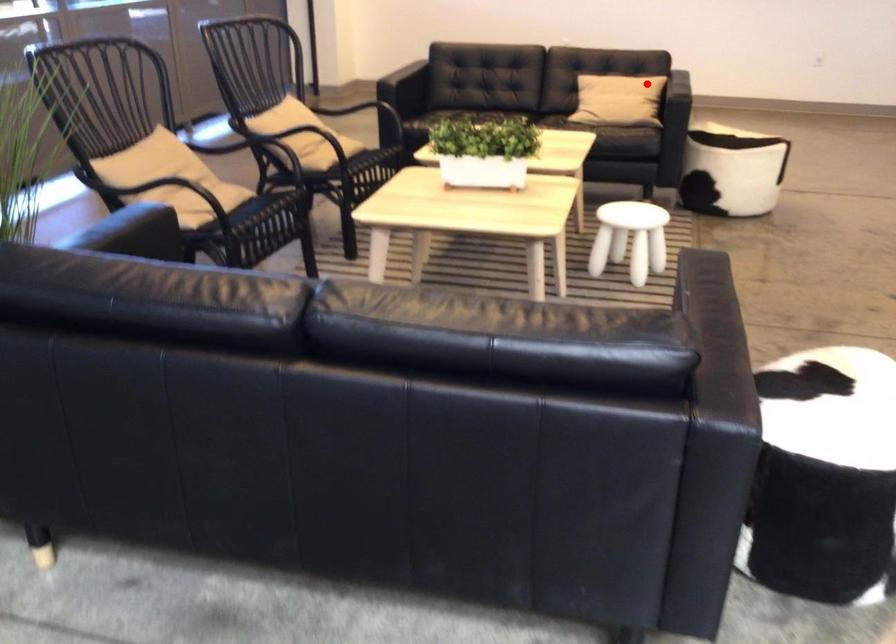
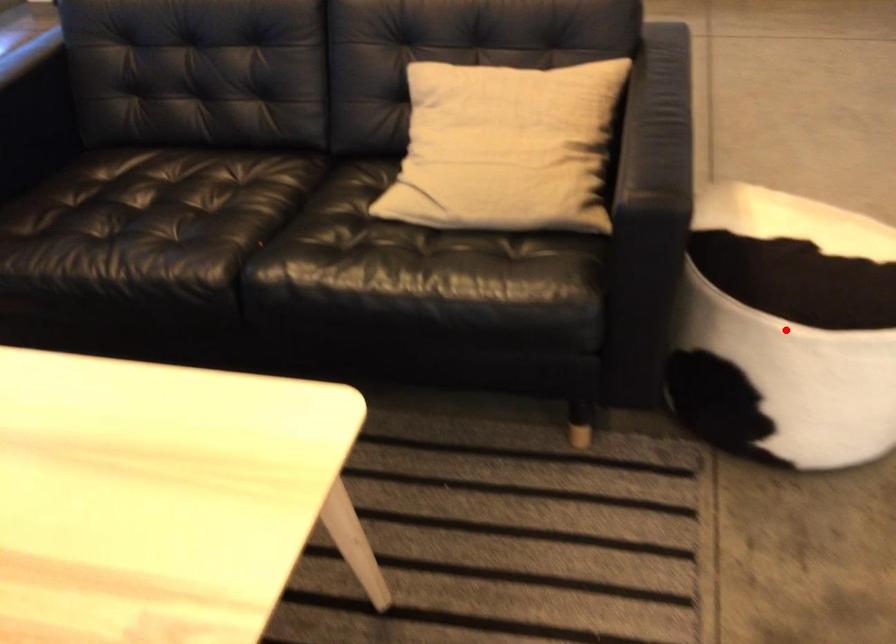
I am providing you with two images of the same scene from different viewpoints. A red point is marked on the first image and another point is marked on the second image. Does the point marked in image1 correspond to the same location as the one in image2?

No